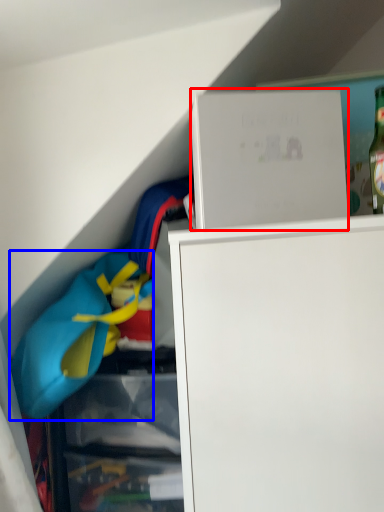
Question: Which point is closer to the camera, cabinet (highlighted by a red box) or clothing (highlighted by a blue box)?

Choices:
 (A) cabinet
 (B) clothing

Answer: (A)